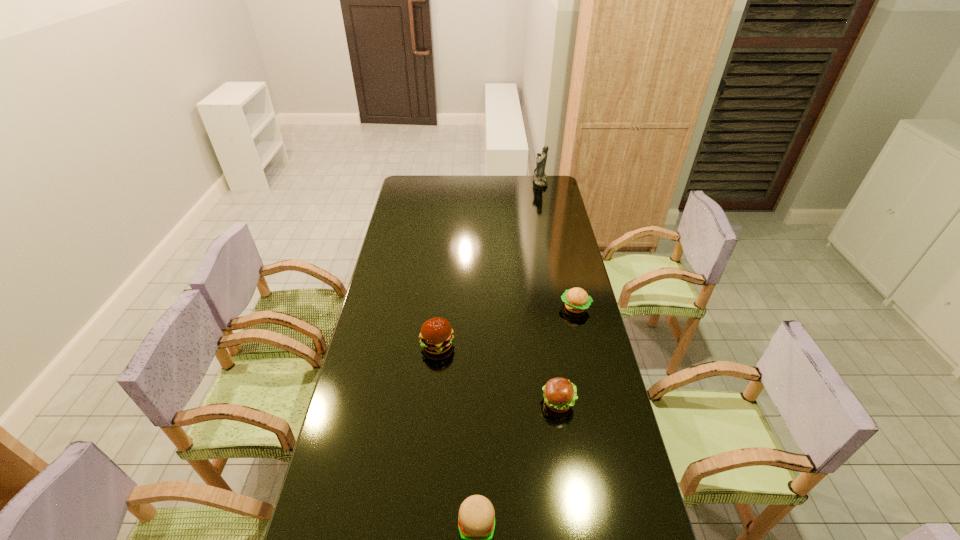
The height and width of the screenshot is (540, 960). In order to click on the farthest object in this screenshot , I will do `click(540, 178)`.

Where is `the tallest object`? Image resolution: width=960 pixels, height=540 pixels. the tallest object is located at coordinates (540, 178).

Identify the location of the tallest hamburger. (436, 335).

Image resolution: width=960 pixels, height=540 pixels. What are the coordinates of `the third farthest object` in the screenshot? It's located at (436, 335).

Where is `the second hamburger from right to left`? The height and width of the screenshot is (540, 960). the second hamburger from right to left is located at coordinates (560, 395).

Locate an element on the screen. This screenshot has height=540, width=960. the third farthest hamburger is located at coordinates (560, 395).

Locate an element on the screen. the rightmost hamburger is located at coordinates (576, 300).

Identify the location of the fourth nearest object. Image resolution: width=960 pixels, height=540 pixels. (576, 300).

This screenshot has width=960, height=540. In order to click on free space located 0.230m on the front-facing side of the figurine in this screenshot , I will do `click(492, 181)`.

Where is `free space located on the front-facing side of the figurine`? free space located on the front-facing side of the figurine is located at coordinates (507, 181).